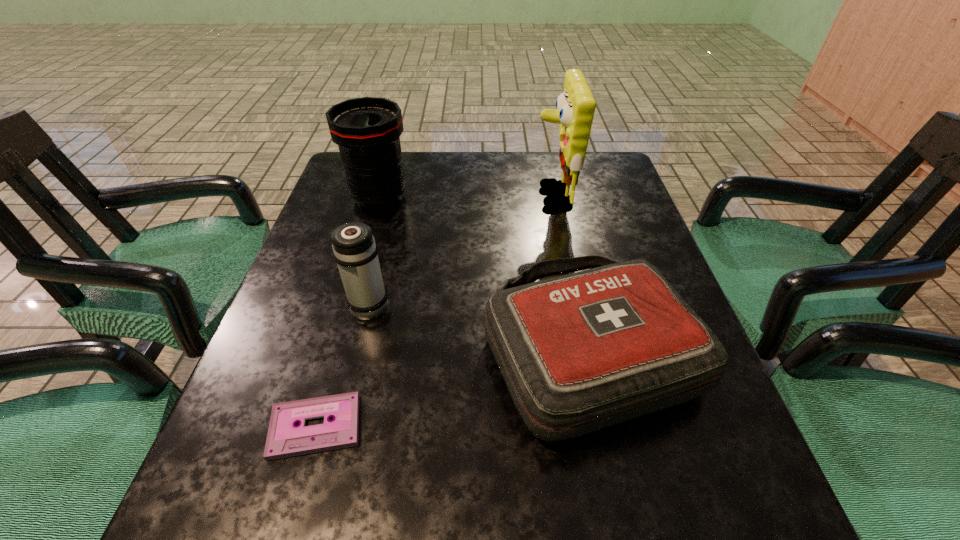
I want to click on the first-aid kit located at the right edge, so click(580, 352).

The width and height of the screenshot is (960, 540). Find the location of `object that is at the far left corner`. object that is at the far left corner is located at coordinates (367, 130).

At what (x,y) coordinates should I click in order to perform the action: click on object that is at the far right corner. Please return your answer as a coordinate pair (x, y). Looking at the image, I should click on (575, 106).

In the image, there is a desktop. At what (x,y) coordinates should I click in order to perform the action: click on vacant space at the far edge. Please return your answer as a coordinate pair (x, y). Looking at the image, I should click on (455, 166).

Locate an element on the screen. vacant area at the near edge is located at coordinates (318, 539).

In the image, there is a desktop. What are the coordinates of `vacant space at the left edge` in the screenshot? It's located at (274, 367).

Where is `vacant area at the right edge`? vacant area at the right edge is located at coordinates (623, 204).

You are a GUI agent. You are given a task and a screenshot of the screen. Output one action in this format:
    pyautogui.click(x=<x>, y=<y>)
    Task: Click on the free region at the near left corner of the desktop
    The width and height of the screenshot is (960, 540).
    Given the screenshot: What is the action you would take?
    (305, 507)

Find the location of `vacant region at the far right corner of the desktop`. vacant region at the far right corner of the desktop is located at coordinates (601, 163).

The image size is (960, 540). What are the coordinates of `free space between the third shortest object and the second shortest object` in the screenshot? It's located at 479,327.